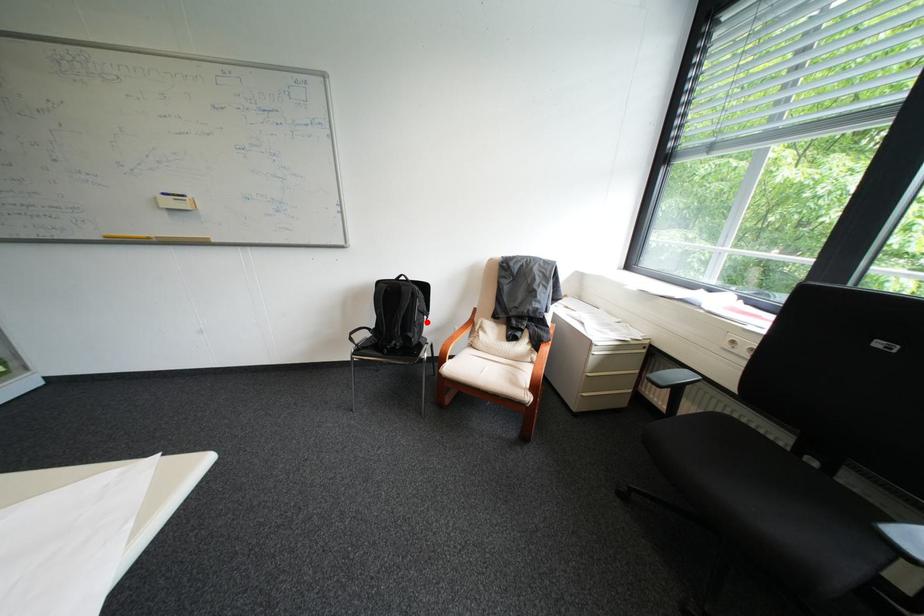
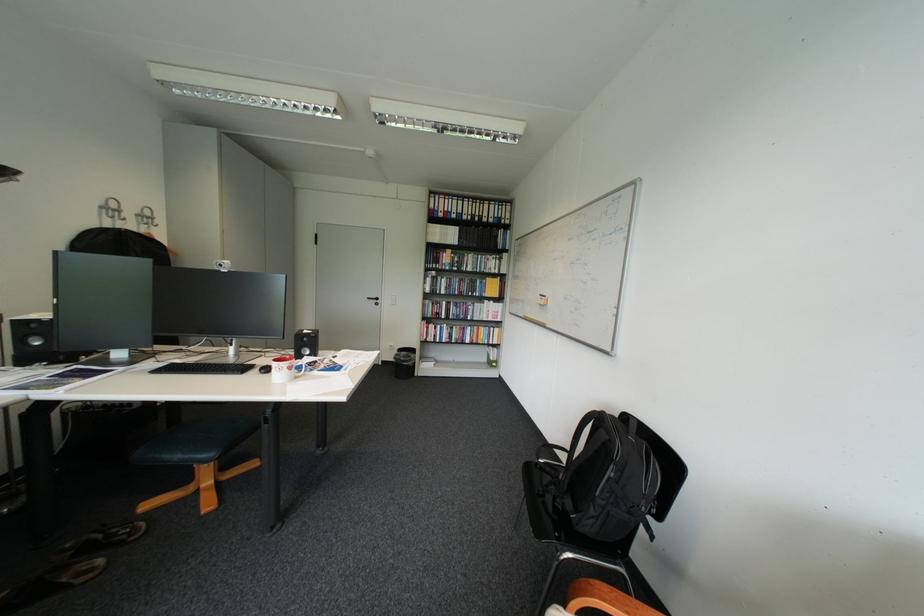
The point at the highlighted location is marked in the first image. Where is the corresponding point in the second image?

(608, 496)